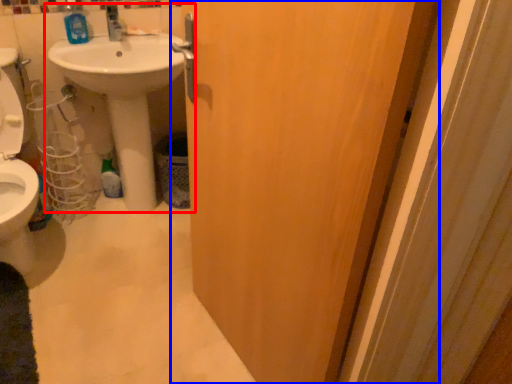
Question: Which point is closer to the camera, sink (highlighted by a red box) or door (highlighted by a blue box)?

Choices:
 (A) sink
 (B) door

Answer: (B)